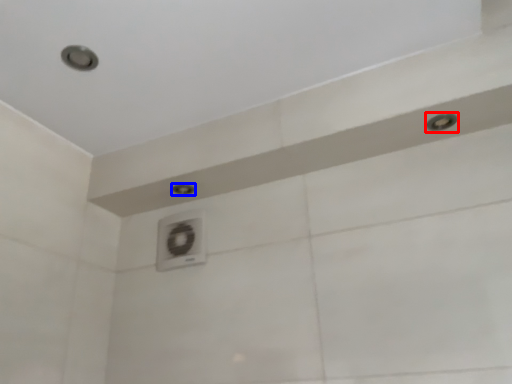
Question: Among these objects, which one is farthest to the camera, shower (highlighted by a red box) or shower (highlighted by a blue box)?

Choices:
 (A) shower
 (B) shower

Answer: (B)